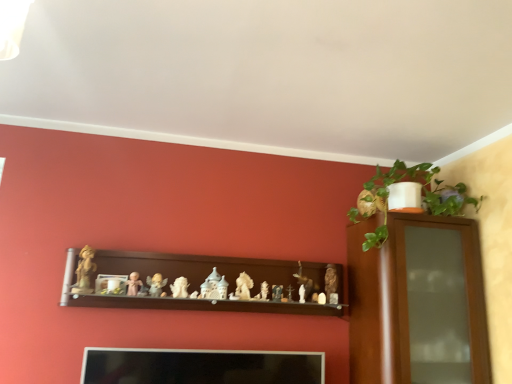
Question: Is white glossy statue at center, the 8th toy in the right-to-left sequence, further to camera compared to smooth wooden cross at center, which ranks as the 3th toy in right-to-left order?

Choices:
 (A) yes
 (B) no

Answer: (B)

Question: Considering the relative positions of white glossy statue at center, positioned as the fourth toy in left-to-right order, and smooth wooden cross at center, acting as the ninth toy starting from the left, in the image provided, is white glossy statue at center, positioned as the fourth toy in left-to-right order, to the right of smooth wooden cross at center, acting as the ninth toy starting from the left, from the viewer's perspective?

Choices:
 (A) yes
 (B) no

Answer: (B)

Question: Is the surface of white glossy statue at center, the 8th toy in the right-to-left sequence, in direct contact with smooth wooden cross at center, which ranks as the 3th toy in right-to-left order?

Choices:
 (A) yes
 (B) no

Answer: (B)

Question: Does white glossy statue at center, positioned as the fourth toy in left-to-right order, lie in front of smooth wooden cross at center, acting as the ninth toy starting from the left?

Choices:
 (A) no
 (B) yes

Answer: (B)

Question: Can you confirm if white glossy statue at center, the 8th toy in the right-to-left sequence, is taller than smooth wooden cross at center, acting as the ninth toy starting from the left?

Choices:
 (A) no
 (B) yes

Answer: (B)

Question: Is matte white figurine at center, which is the fifth toy in right-to-left order, to the left or to the right of matte beige figurine at center, the 2th toy viewed from the left, in the image?

Choices:
 (A) right
 (B) left

Answer: (A)

Question: From the image's perspective, is matte white figurine at center, which ranks as the seventh toy in left-to-right order, above or below matte beige figurine at center, which is the 10th toy from right to left?

Choices:
 (A) below
 (B) above

Answer: (A)

Question: Considering their positions, is matte white figurine at center, which is the fifth toy in right-to-left order, located in front of or behind matte beige figurine at center, which is the 10th toy from right to left?

Choices:
 (A) behind
 (B) front

Answer: (A)

Question: In terms of size, does matte white figurine at center, which ranks as the seventh toy in left-to-right order, appear bigger or smaller than matte beige figurine at center, the 2th toy viewed from the left?

Choices:
 (A) small
 (B) big

Answer: (B)

Question: Based on their sizes in the image, would you say brown wooden shelf at center is bigger or smaller than matte beige figurine at center, the 2th toy viewed from the left?

Choices:
 (A) small
 (B) big

Answer: (B)

Question: In the image, is brown wooden shelf at center on the left side or the right side of matte beige figurine at center, which is the 10th toy from right to left?

Choices:
 (A) right
 (B) left

Answer: (A)

Question: Is brown wooden shelf at center situated inside matte beige figurine at center, which is the 10th toy from right to left, or outside?

Choices:
 (A) outside
 (B) inside

Answer: (A)

Question: From the image's perspective, is brown wooden shelf at center above or below matte beige figurine at center, the 2th toy viewed from the left?

Choices:
 (A) above
 (B) below

Answer: (B)

Question: Considering the positions of smooth wooden cross at center, which ranks as the 3th toy in right-to-left order, and matte brown statue at center, arranged as the eleventh toy when viewed from the left, in the image, is smooth wooden cross at center, which ranks as the 3th toy in right-to-left order, wider or thinner than matte brown statue at center, arranged as the eleventh toy when viewed from the left,?

Choices:
 (A) thin
 (B) wide

Answer: (A)

Question: In the image, is smooth wooden cross at center, acting as the ninth toy starting from the left, on the left side or the right side of matte brown statue at center, which is counted as the first toy, starting from the right?

Choices:
 (A) left
 (B) right

Answer: (A)